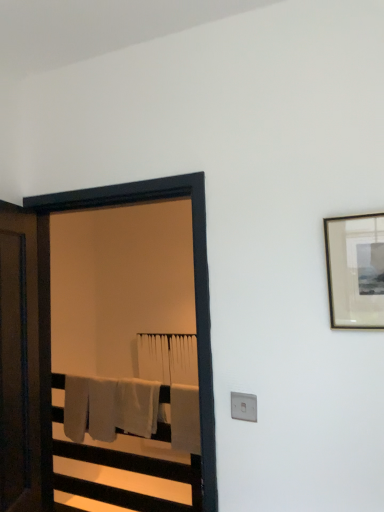
Question: Are matte black picture frame at upper right and white soft bath towel at center, marked as the second bath towel in a back-to-front arrangement, beside each other?

Choices:
 (A) yes
 (B) no

Answer: (B)

Question: From a real-world perspective, does matte black picture frame at upper right stand above white soft bath towel at center, marked as the second bath towel in a back-to-front arrangement?

Choices:
 (A) no
 (B) yes

Answer: (B)

Question: Can you confirm if matte black picture frame at upper right is taller than white soft bath towel at center, which ranks as the second bath towel in front-to-back order?

Choices:
 (A) yes
 (B) no

Answer: (B)

Question: From the image's perspective, is matte black picture frame at upper right on top of white soft bath towel at center, which ranks as the second bath towel in front-to-back order?

Choices:
 (A) yes
 (B) no

Answer: (A)

Question: Can you confirm if matte black picture frame at upper right is smaller than white soft bath towel at center, which ranks as the second bath towel in front-to-back order?

Choices:
 (A) yes
 (B) no

Answer: (A)

Question: Considering the positions of point (117, 412) and point (8, 402), is point (117, 412) closer or farther from the camera than point (8, 402)?

Choices:
 (A) closer
 (B) farther

Answer: (B)

Question: Is white soft bath towel at center, which ranks as the second bath towel in front-to-back order, in front of or behind brown wooden door at left in the image?

Choices:
 (A) behind
 (B) front

Answer: (A)

Question: Would you say white soft bath towel at center, marked as the second bath towel in a back-to-front arrangement, is to the left or to the right of brown wooden door at left in the picture?

Choices:
 (A) left
 (B) right

Answer: (B)

Question: Is white soft bath towel at center, marked as the second bath towel in a back-to-front arrangement, taller or shorter than brown wooden door at left?

Choices:
 (A) tall
 (B) short

Answer: (B)

Question: Is point (200, 241) positioned closer to the camera than point (193, 371)?

Choices:
 (A) closer
 (B) farther

Answer: (A)

Question: Looking at the image, does black wooden screen door at left seem bigger or smaller compared to white cotton bath towel at center, arranged as the first bath towel when viewed from the back?

Choices:
 (A) big
 (B) small

Answer: (A)

Question: From the image's perspective, relative to white cotton bath towel at center, arranged as the first bath towel when viewed from the back, is black wooden screen door at left above or below?

Choices:
 (A) above
 (B) below

Answer: (A)

Question: From a real-world perspective, is black wooden screen door at left positioned above or below white cotton bath towel at center, marked as the third bath towel in a front-to-back arrangement?

Choices:
 (A) below
 (B) above

Answer: (B)

Question: Would you say white cotton bath towel at center, arranged as the first bath towel when viewed from the back, is to the left or to the right of black wooden screen door at left in the picture?

Choices:
 (A) right
 (B) left

Answer: (A)

Question: From the image's perspective, relative to black wooden screen door at left, is white cotton bath towel at center, marked as the third bath towel in a front-to-back arrangement, above or below?

Choices:
 (A) above
 (B) below

Answer: (B)